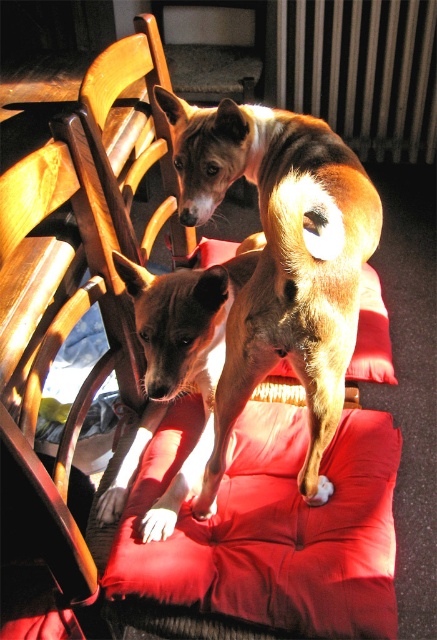
Does point (226, 186) come closer to viewer compared to point (196, 260)?

That is True.

Locate an element on the screen. This screenshot has width=437, height=640. brown furry dog at center is located at coordinates coord(281,259).

Where is `brown furry dog at center`? brown furry dog at center is located at coordinates (281, 259).